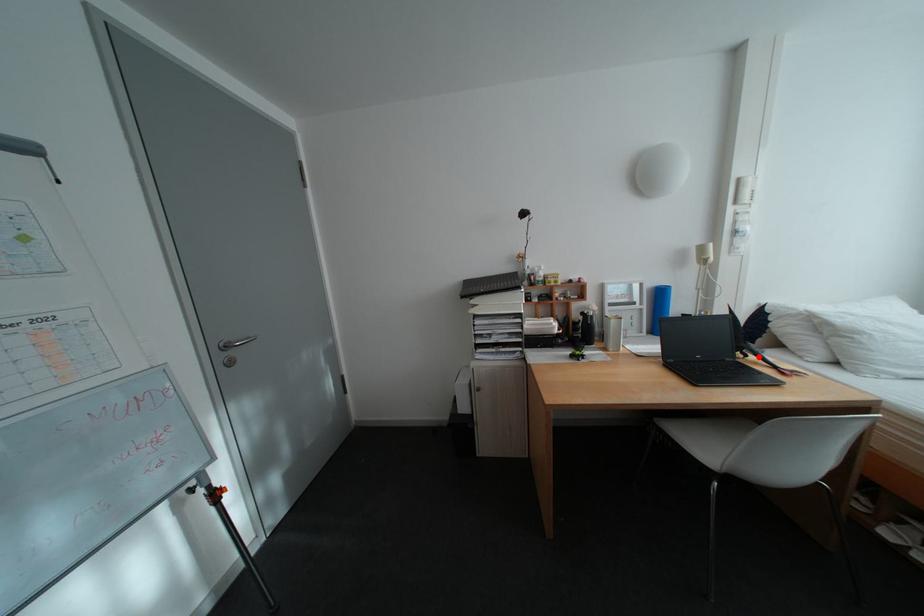
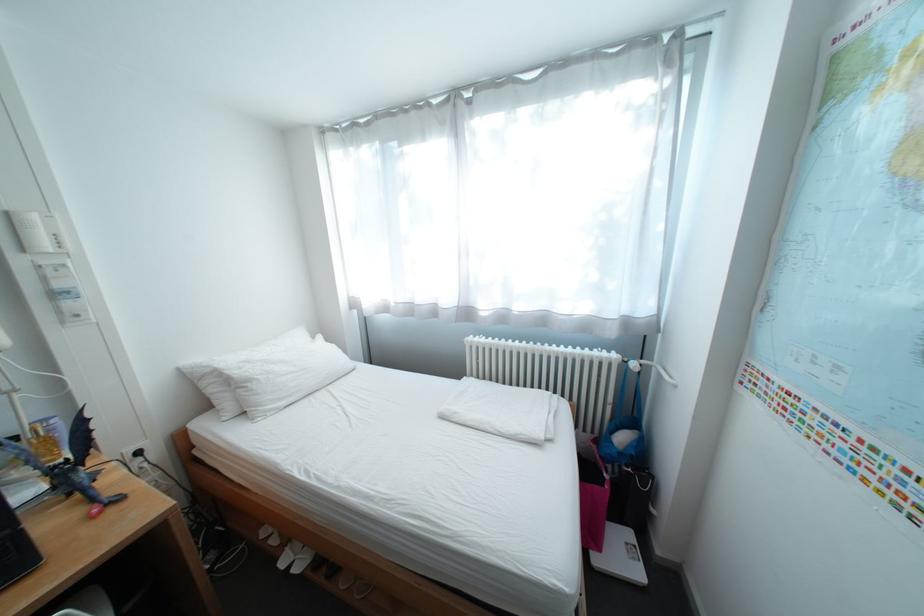
The point at the highlighted location is marked in the first image. Where is the corresponding point in the second image?

(81, 495)